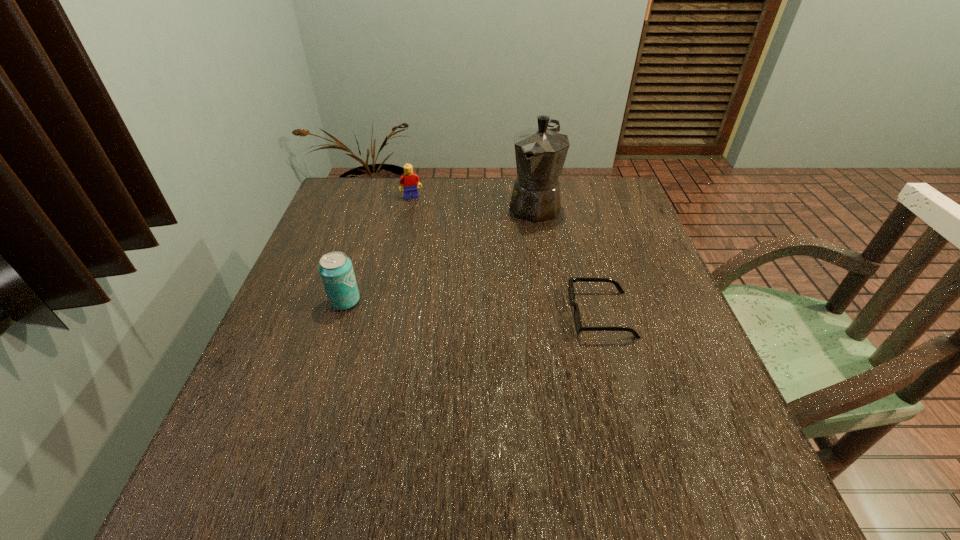
In the image, there is a desktop. Where is `vacant space at the left edge`? This screenshot has width=960, height=540. vacant space at the left edge is located at coordinates (275, 379).

This screenshot has height=540, width=960. In order to click on vacant space at the right edge of the desktop in this screenshot , I will do 587,223.

Where is `vacant region at the far left corner of the desktop`? The image size is (960, 540). vacant region at the far left corner of the desktop is located at coordinates (327, 207).

Locate an element on the screen. The width and height of the screenshot is (960, 540). free location at the far right corner is located at coordinates (591, 215).

Identify the location of unoccupied area between the leftmost object and the sunglasses. (473, 307).

Where is `vacant space that is in between the sunglasses and the beer can`? This screenshot has width=960, height=540. vacant space that is in between the sunglasses and the beer can is located at coordinates (473, 307).

Image resolution: width=960 pixels, height=540 pixels. I want to click on vacant area that lies between the sunglasses and the Lego, so click(x=506, y=255).

Where is `free point between the shortest object and the beer can`? free point between the shortest object and the beer can is located at coordinates (473, 307).

Locate an element on the screen. The image size is (960, 540). vacant region between the beer can and the coffeepot is located at coordinates (440, 253).

The image size is (960, 540). I want to click on vacant area that lies between the third object from right to left and the leftmost object, so click(x=378, y=249).